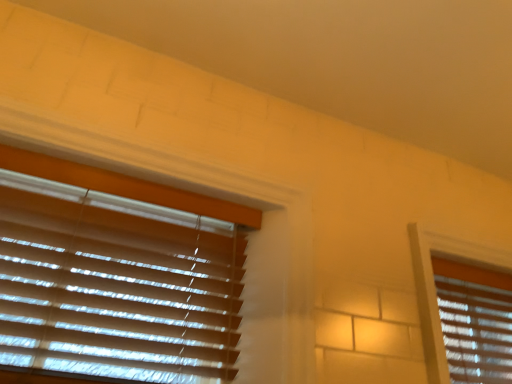
Where is `wooden blinds at left, which is the 2th window blind from back to front`? The height and width of the screenshot is (384, 512). wooden blinds at left, which is the 2th window blind from back to front is located at coordinates (116, 274).

This screenshot has width=512, height=384. What do you see at coordinates (116, 274) in the screenshot? I see `wooden blinds at left, which appears as the 1th window blind when viewed from the front` at bounding box center [116, 274].

Measure the distance between point (23, 317) and camera.

Point (23, 317) and camera are 38.07 inches apart from each other.

The width and height of the screenshot is (512, 384). Describe the element at coordinates (475, 321) in the screenshot. I see `wooden blinds at right, the 2th window blind when ordered from left to right` at that location.

This screenshot has height=384, width=512. I want to click on wooden blinds at right, which ranks as the second window blind in front-to-back order, so click(x=475, y=321).

Measure the distance between point [457,301] and camera.

Point [457,301] and camera are 1.56 meters apart.

The width and height of the screenshot is (512, 384). I want to click on wooden blinds at left, which is the 2th window blind from back to front, so click(116, 274).

Considering the positions of objects wooden blinds at left, positioned as the 1th window blind in left-to-right order, and wooden blinds at right, the 2th window blind when ordered from left to right, in the image provided, who is more to the right, wooden blinds at left, positioned as the 1th window blind in left-to-right order, or wooden blinds at right, the 2th window blind when ordered from left to right,?

wooden blinds at right, the 2th window blind when ordered from left to right, is more to the right.

Between wooden blinds at left, the 2th window blind when ordered from right to left, and wooden blinds at right, the first window blind viewed from the back, which one is positioned in front?

wooden blinds at left, the 2th window blind when ordered from right to left, is more forward.

Is point (132, 249) positioned behind point (444, 291)?

No, (132, 249) is closer to viewer.

From the image's perspective, who appears lower, wooden blinds at left, the 2th window blind when ordered from right to left, or wooden blinds at right, the 2th window blind when ordered from left to right?

wooden blinds at right, the 2th window blind when ordered from left to right, appears lower in the image.

From a real-world perspective, is wooden blinds at left, which is the 2th window blind from back to front, positioned above or below wooden blinds at right, the first window blind viewed from the back?

From a real-world perspective, wooden blinds at left, which is the 2th window blind from back to front, is physically below wooden blinds at right, the first window blind viewed from the back.

Between wooden blinds at left, which appears as the 1th window blind when viewed from the front, and wooden blinds at right, which ranks as the second window blind in front-to-back order, which one has smaller width?

wooden blinds at left, which appears as the 1th window blind when viewed from the front, is thinner.

Which of these two, wooden blinds at left, positioned as the 1th window blind in left-to-right order, or wooden blinds at right, which ranks as the second window blind in front-to-back order, stands shorter?

With less height is wooden blinds at right, which ranks as the second window blind in front-to-back order.

Who is smaller, wooden blinds at left, which appears as the 1th window blind when viewed from the front, or wooden blinds at right, which ranks as the second window blind in front-to-back order?

wooden blinds at left, which appears as the 1th window blind when viewed from the front.

Is wooden blinds at left, which appears as the 1th window blind when viewed from the front, not inside wooden blinds at right, the 2th window blind when ordered from left to right?

wooden blinds at left, which appears as the 1th window blind when viewed from the front, is positioned outside wooden blinds at right, the 2th window blind when ordered from left to right.

Looking at this image, is wooden blinds at left, the 2th window blind when ordered from right to left, touching wooden blinds at right, the 2th window blind when ordered from left to right?

No, wooden blinds at left, the 2th window blind when ordered from right to left, is not beside wooden blinds at right, the 2th window blind when ordered from left to right.

Is wooden blinds at left, which is the 2th window blind from back to front, facing away from wooden blinds at right, which is the 1th window blind in right-to-left order?

That's not correct — wooden blinds at left, which is the 2th window blind from back to front, is not looking away from wooden blinds at right, which is the 1th window blind in right-to-left order.

How many degrees apart are the facing directions of wooden blinds at left, the 2th window blind when ordered from right to left, and wooden blinds at right, which ranks as the second window blind in front-to-back order?

0.123 degrees separate the facing orientations of wooden blinds at left, the 2th window blind when ordered from right to left, and wooden blinds at right, which ranks as the second window blind in front-to-back order.

In order to click on window blind that is on the right side of wooden blinds at left, the 2th window blind when ordered from right to left in this screenshot , I will do `click(475, 321)`.

Is wooden blinds at right, which ranks as the second window blind in front-to-back order, to the right of wooden blinds at left, positioned as the 1th window blind in left-to-right order, from the viewer's perspective?

Yes, wooden blinds at right, which ranks as the second window blind in front-to-back order, is to the right of wooden blinds at left, positioned as the 1th window blind in left-to-right order.

Which object is closer to the camera taking this photo, wooden blinds at right, which ranks as the second window blind in front-to-back order, or wooden blinds at left, the 2th window blind when ordered from right to left?

wooden blinds at left, the 2th window blind when ordered from right to left, is closer to the camera.

Is point (484, 350) closer or farther from the camera than point (76, 304)?

Point (484, 350).

From the image's perspective, which one is positioned higher, wooden blinds at right, which ranks as the second window blind in front-to-back order, or wooden blinds at left, the 2th window blind when ordered from right to left?

From the image's view, wooden blinds at left, the 2th window blind when ordered from right to left, is above.

From a real-world perspective, which object rests below the other?

wooden blinds at left, the 2th window blind when ordered from right to left, is physically lower.

In terms of width, does wooden blinds at right, which ranks as the second window blind in front-to-back order, look wider or thinner when compared to wooden blinds at left, which appears as the 1th window blind when viewed from the front?

Clearly, wooden blinds at right, which ranks as the second window blind in front-to-back order, has more width compared to wooden blinds at left, which appears as the 1th window blind when viewed from the front.

Between wooden blinds at right, the first window blind viewed from the back, and wooden blinds at left, positioned as the 1th window blind in left-to-right order, which one has less height?

wooden blinds at right, the first window blind viewed from the back, is shorter.

Who is bigger, wooden blinds at right, the 2th window blind when ordered from left to right, or wooden blinds at left, which appears as the 1th window blind when viewed from the front?

wooden blinds at right, the 2th window blind when ordered from left to right, is bigger.

Based on the photo, does wooden blinds at right, which is the 1th window blind in right-to-left order, contain wooden blinds at left, positioned as the 1th window blind in left-to-right order?

No, wooden blinds at left, positioned as the 1th window blind in left-to-right order, is located outside of wooden blinds at right, which is the 1th window blind in right-to-left order.

Is wooden blinds at right, which ranks as the second window blind in front-to-back order, not close to wooden blinds at left, the 2th window blind when ordered from right to left?

Yes, wooden blinds at right, which ranks as the second window blind in front-to-back order, and wooden blinds at left, the 2th window blind when ordered from right to left, are located far from each other.

Is wooden blinds at right, which ranks as the second window blind in front-to-back order, oriented away from wooden blinds at left, which appears as the 1th window blind when viewed from the front?

No, wooden blinds at right, which ranks as the second window blind in front-to-back order, is not facing away from wooden blinds at left, which appears as the 1th window blind when viewed from the front.

Where is `window blind located above the wooden blinds at left, the 2th window blind when ordered from right to left (from a real-world perspective)`? This screenshot has height=384, width=512. window blind located above the wooden blinds at left, the 2th window blind when ordered from right to left (from a real-world perspective) is located at coordinates (475, 321).

In order to click on window blind below the wooden blinds at left, which appears as the 1th window blind when viewed from the front (from the image's perspective) in this screenshot , I will do `click(475, 321)`.

I want to click on window blind beneath the wooden blinds at right, the 2th window blind when ordered from left to right (from a real-world perspective), so click(x=116, y=274).